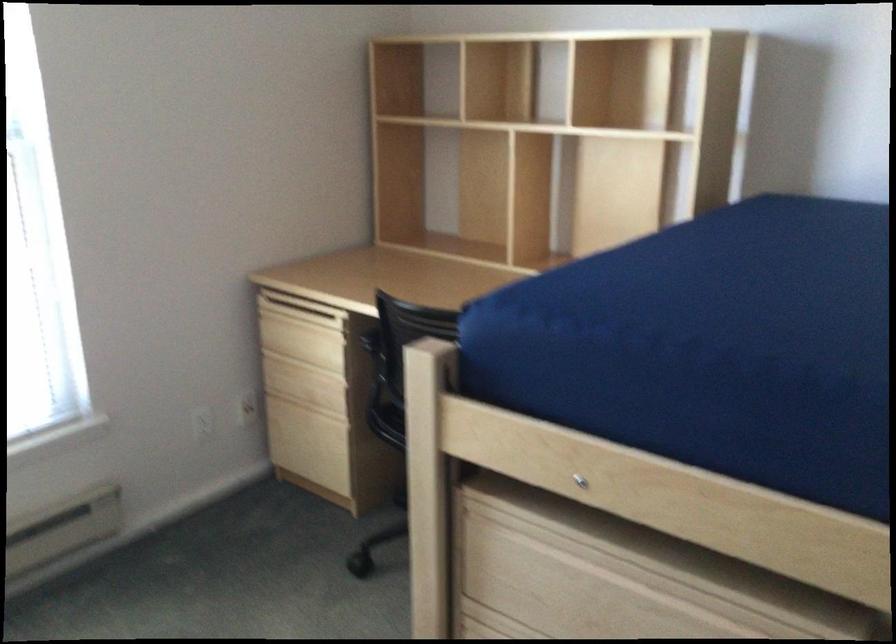
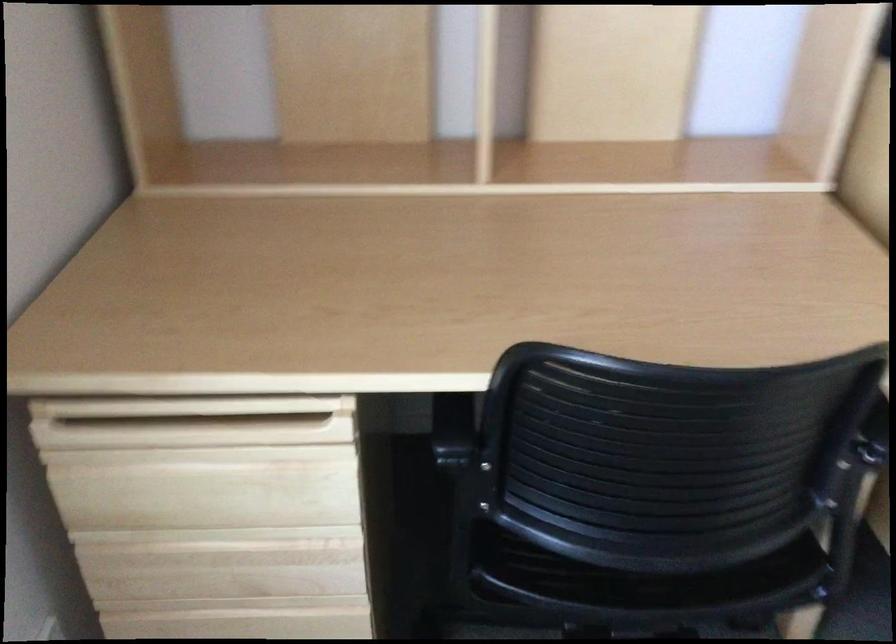
Find the pixel in the second image that matches (308,316) in the first image.

(192, 422)